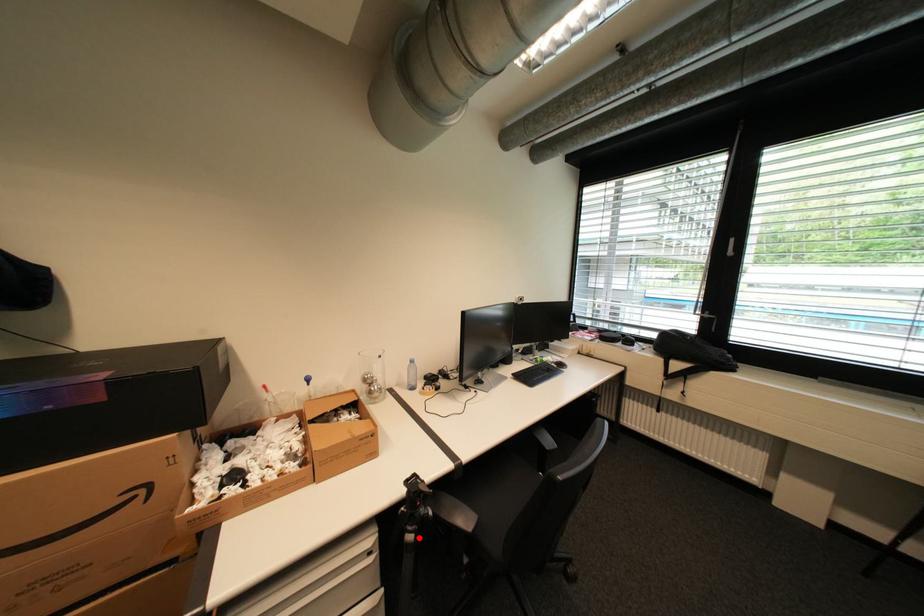
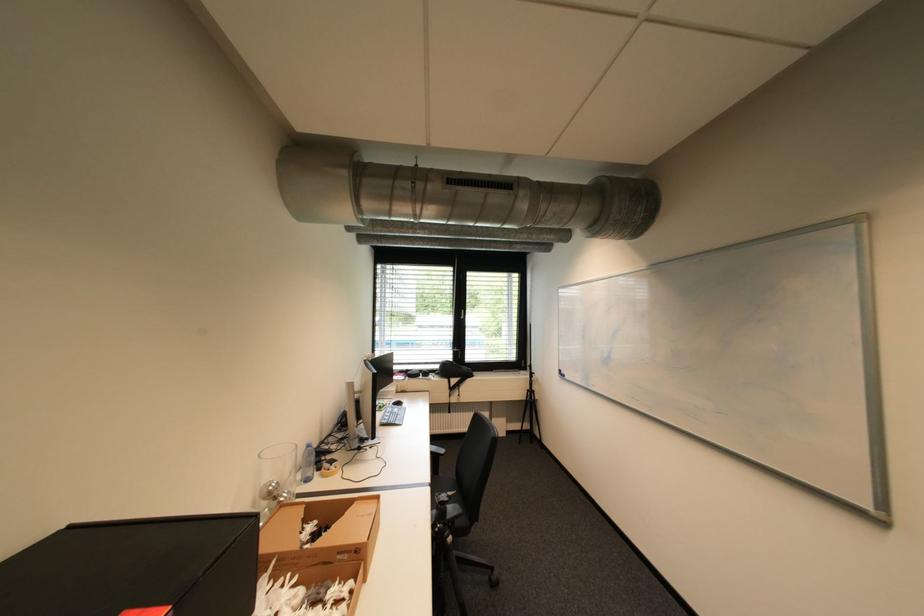
Question: A red point is marked in image1. In image2, is the corresponding 3D point closer to the camera or farther? Reply with the corresponding letter.

Choices:
 (A) The corresponding 3D point is closer.
 (B) The corresponding 3D point is farther.

Answer: (A)